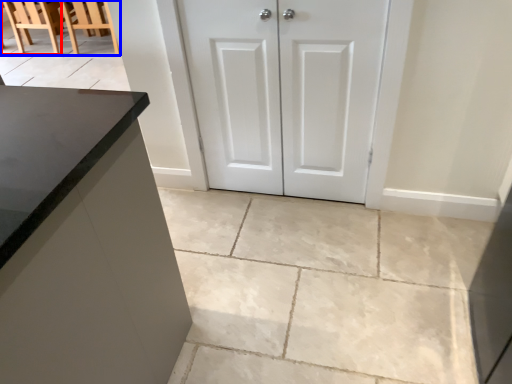
Question: Among these objects, which one is nearest to the camera, chair (highlighted by a red box) or chair (highlighted by a blue box)?

Choices:
 (A) chair
 (B) chair

Answer: (B)